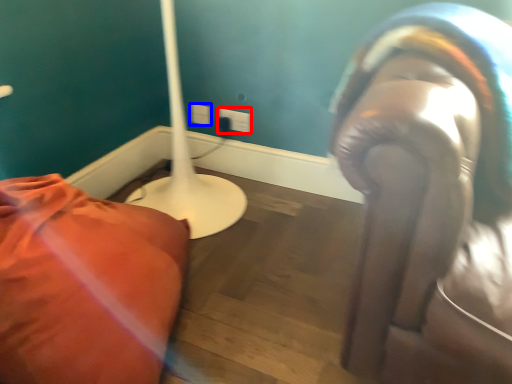
Question: Which object is closer to the camera taking this photo, electric outlet (highlighted by a red box) or electric outlet (highlighted by a blue box)?

Choices:
 (A) electric outlet
 (B) electric outlet

Answer: (A)